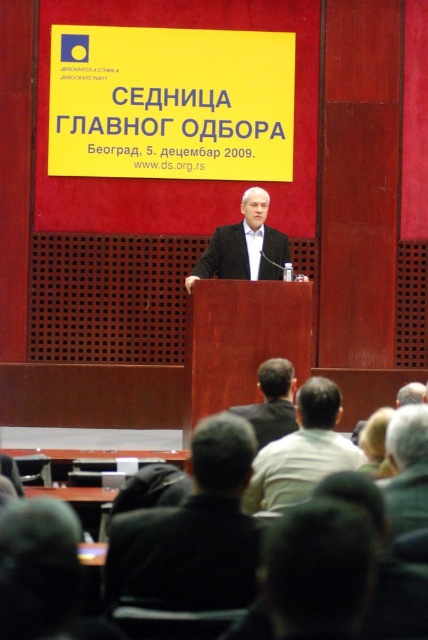
Question: Which point is farther to the camera?

Choices:
 (A) (262, 404)
 (B) (237, 266)
 (C) (235, 554)

Answer: (B)

Question: Which object appears farthest from the camera in this image?

Choices:
 (A) dark brown hair at center
 (B) dark suit at center
 (C) white cotton shirt at center
 (D) black leather jacket at center

Answer: (B)

Question: Does white cotton shirt at center have a lesser width compared to dark brown hair at center?

Choices:
 (A) no
 (B) yes

Answer: (A)

Question: Which point is closer to the camera?

Choices:
 (A) white cotton shirt at center
 (B) dark suit at center

Answer: (A)

Question: Does black leather jacket at center appear on the left side of dark brown hair at center?

Choices:
 (A) yes
 (B) no

Answer: (A)

Question: Does black leather jacket at center appear over dark brown hair at center?

Choices:
 (A) yes
 (B) no

Answer: (B)